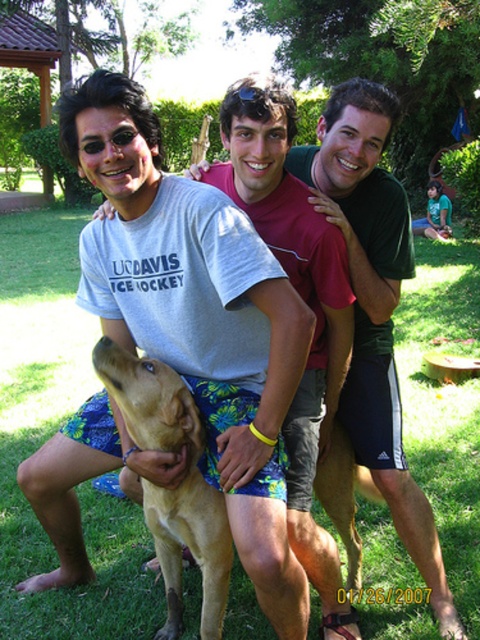
Question: Among these objects, which one is farthest from the camera?

Choices:
 (A) green grass at center
 (B) blue plastic goggles at center
 (C) light brown fur dog at center

Answer: (A)

Question: Which of the following is the farthest from the observer?

Choices:
 (A) (261, 88)
 (B) (249, 342)

Answer: (B)

Question: Observing the image, what is the correct spatial positioning of golden fur dog at center in reference to blue plastic goggles at center?

Choices:
 (A) right
 (B) left

Answer: (B)

Question: Which object is closer to the camera taking this photo?

Choices:
 (A) light brown fur dog at center
 (B) blue plastic goggles at center
 (C) golden fur dog at center
 (D) green grass at center

Answer: (A)

Question: Does golden fur dog at center appear over blue plastic goggles at center?

Choices:
 (A) yes
 (B) no

Answer: (B)

Question: Is green grass at center further to the viewer compared to golden fur dog at center?

Choices:
 (A) no
 (B) yes

Answer: (B)